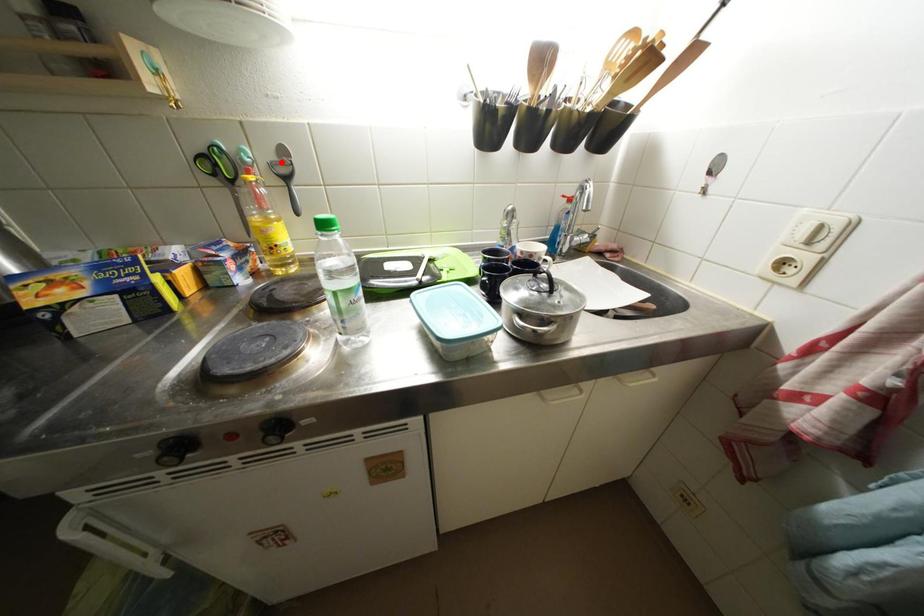
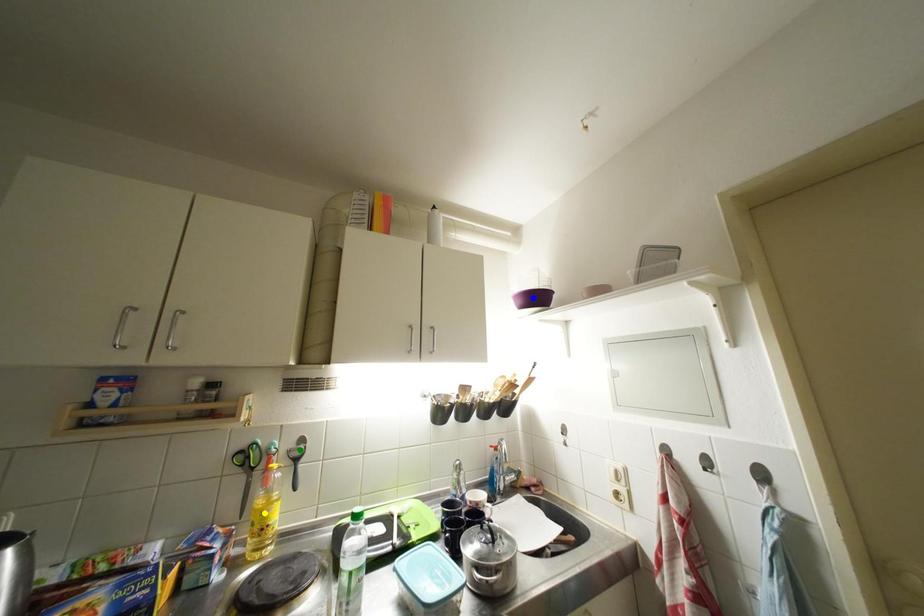
Question: I am providing you with two images of the same scene from different viewpoints. A red point is marked on the first image. You are given multiple points on the second image. Which point in image 2 is actually the same real-world point as the red point in image 1?

Choices:
 (A) blue point
 (B) yellow point
 (C) green point

Answer: (C)